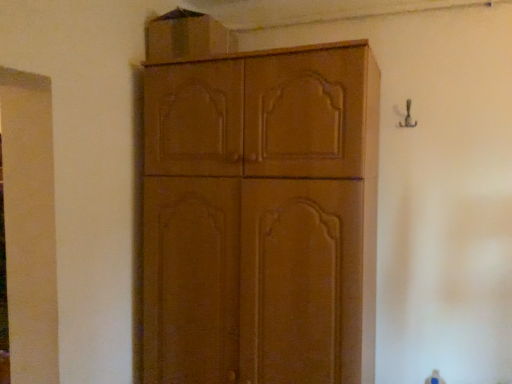
Question: Does matte brown cabinet at upper center, which is counted as the first cabinetry, starting from the top, have a lesser height compared to matte wood cabinet at center, positioned as the 1th cabinetry in bottom-to-top order?

Choices:
 (A) yes
 (B) no

Answer: (A)

Question: Is matte brown cabinet at upper center, acting as the second cabinetry starting from the bottom, bigger than matte wood cabinet at center, the second cabinetry in the top-to-bottom sequence?

Choices:
 (A) no
 (B) yes

Answer: (A)

Question: From the image's perspective, does matte brown cabinet at upper center, acting as the second cabinetry starting from the bottom, appear higher than matte wood cabinet at center, the second cabinetry in the top-to-bottom sequence?

Choices:
 (A) yes
 (B) no

Answer: (A)

Question: Is matte brown cabinet at upper center, which is counted as the first cabinetry, starting from the top, surrounding matte wood cabinet at center, the second cabinetry in the top-to-bottom sequence?

Choices:
 (A) yes
 (B) no

Answer: (B)

Question: Can you confirm if matte brown cabinet at upper center, which is counted as the first cabinetry, starting from the top, is wider than matte wood cabinet at center, positioned as the 1th cabinetry in bottom-to-top order?

Choices:
 (A) yes
 (B) no

Answer: (B)

Question: Can we say matte brown cabinet at upper center, acting as the second cabinetry starting from the bottom, lies outside matte wood cabinet at center, positioned as the 1th cabinetry in bottom-to-top order?

Choices:
 (A) yes
 (B) no

Answer: (A)

Question: Is matte wood cabinet at center, positioned as the 1th cabinetry in bottom-to-top order, facing towards matte brown cabinet at upper center, acting as the second cabinetry starting from the bottom?

Choices:
 (A) yes
 (B) no

Answer: (B)

Question: Are matte wood cabinet at center, positioned as the 1th cabinetry in bottom-to-top order, and matte brown cabinet at upper center, which is counted as the first cabinetry, starting from the top, located far from each other?

Choices:
 (A) yes
 (B) no

Answer: (B)

Question: From the image's perspective, is matte wood cabinet at center, the second cabinetry in the top-to-bottom sequence, over matte brown cabinet at upper center, which is counted as the first cabinetry, starting from the top?

Choices:
 (A) yes
 (B) no

Answer: (B)

Question: Is matte wood cabinet at center, positioned as the 1th cabinetry in bottom-to-top order, to the right of matte brown cabinet at upper center, which is counted as the first cabinetry, starting from the top, from the viewer's perspective?

Choices:
 (A) no
 (B) yes

Answer: (B)

Question: From the image's perspective, is matte wood cabinet at center, the second cabinetry in the top-to-bottom sequence, under matte brown cabinet at upper center, acting as the second cabinetry starting from the bottom?

Choices:
 (A) yes
 (B) no

Answer: (A)

Question: From a real-world perspective, is matte wood cabinet at center, positioned as the 1th cabinetry in bottom-to-top order, beneath matte brown cabinet at upper center, which is counted as the first cabinetry, starting from the top?

Choices:
 (A) yes
 (B) no

Answer: (A)

Question: Considering the positions of point (279, 218) and point (181, 57), is point (279, 218) closer or farther from the camera than point (181, 57)?

Choices:
 (A) closer
 (B) farther

Answer: (A)